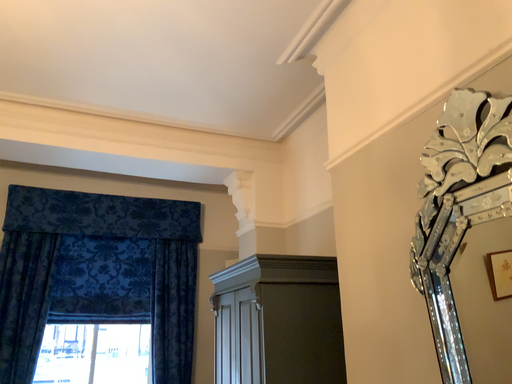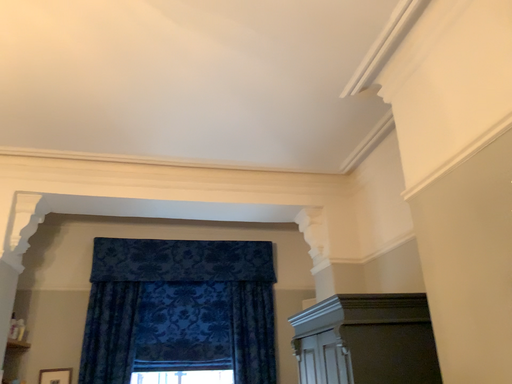
Question: How did the camera likely rotate when shooting the video?

Choices:
 (A) rotated right
 (B) rotated left

Answer: (B)